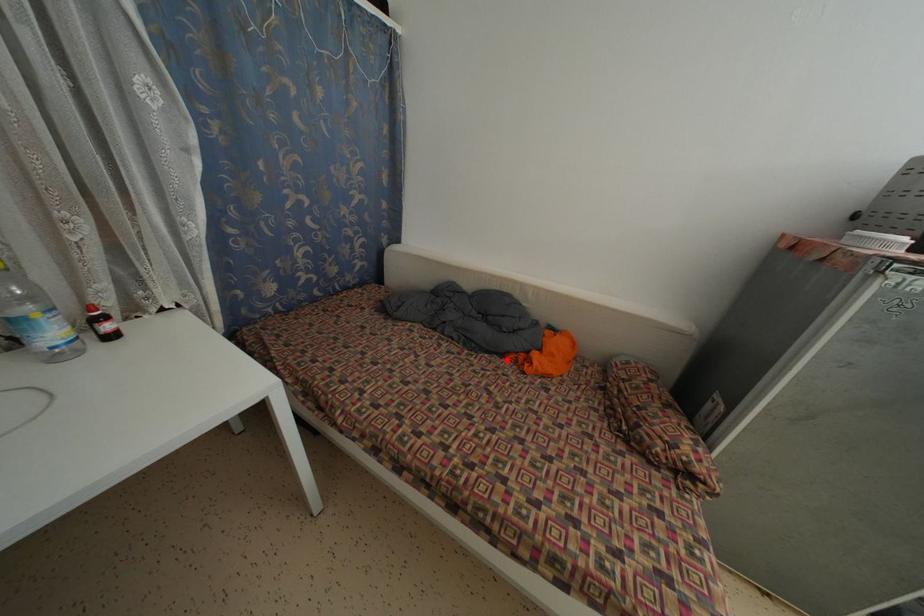
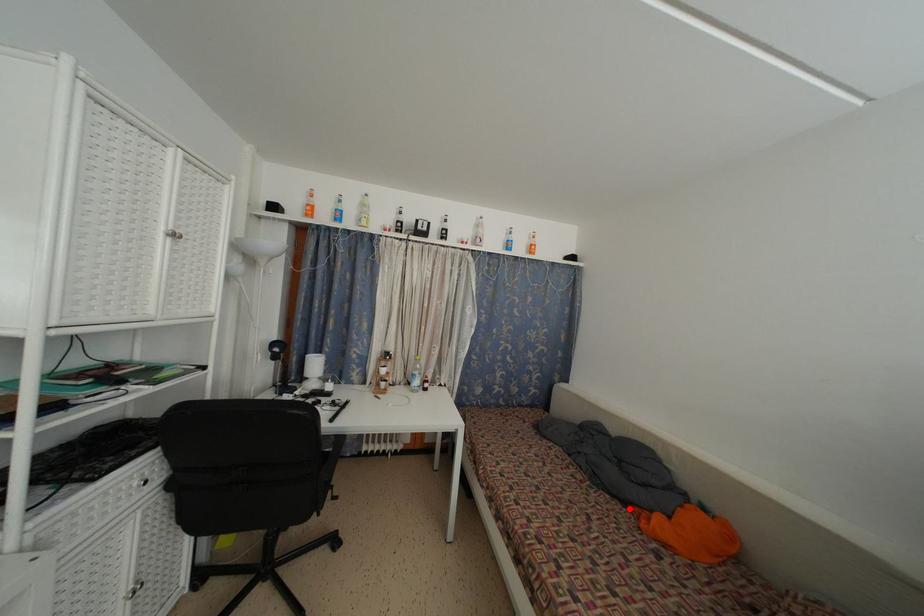
In the scene shown: I am providing you with two images of the same scene from different viewpoints. A red point is marked on the first image and another point is marked on the second image. Is the red point in image1 aligned with the point shown in image2?

Yes